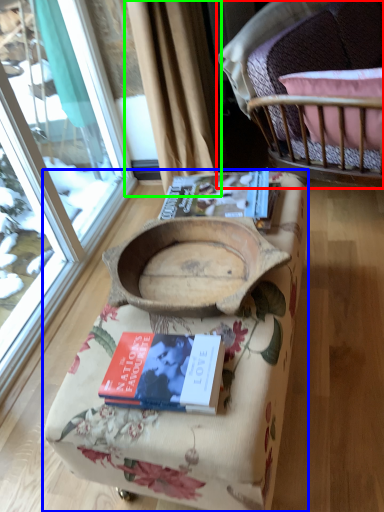
Question: Which object is positioned farthest from chair (highlighted by a red box)? Select from furniture (highlighted by a blue box) and curtain (highlighted by a green box).

Choices:
 (A) furniture
 (B) curtain

Answer: (A)